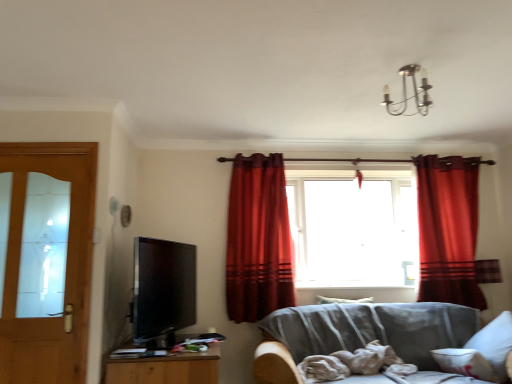
Question: Considering their positions, is wooden cabinet at lower left located in front of or behind gray fabric couch at lower right?

Choices:
 (A) behind
 (B) front

Answer: (A)

Question: From their relative heights in the image, would you say wooden cabinet at lower left is taller or shorter than gray fabric couch at lower right?

Choices:
 (A) tall
 (B) short

Answer: (B)

Question: Considering the real-world distances, which object is farthest from the white soft pillow at lower right, which is counted as the first pillow, starting from the front?

Choices:
 (A) wooden cabinet at lower left
 (B) velvet red curtain at center, the 2th curtain from the right
 (C) satin red curtain at right, marked as the 1th curtain in a right-to-left arrangement
 (D) white soft pillow at center, the 2th pillow positioned from the front
 (E) transparent glass window at center

Answer: (A)

Question: Considering the real-world distances, which object is farthest from the matte black tv at left?

Choices:
 (A) white soft pillow at center, which ranks as the second pillow in bottom-to-top order
 (B) satin red curtain at right, marked as the 1th curtain in a right-to-left arrangement
 (C) light brown wooden door at left
 (D) wooden cabinet at lower left
 (E) transparent glass window at center

Answer: (B)